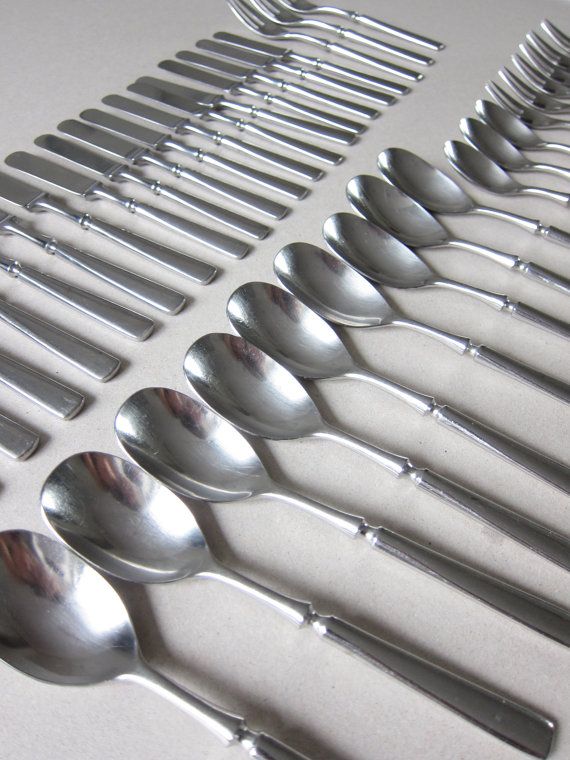
Locate an element on the screen. forks is located at coordinates (531, 115), (543, 103), (551, 87), (555, 73), (561, 62), (565, 40).